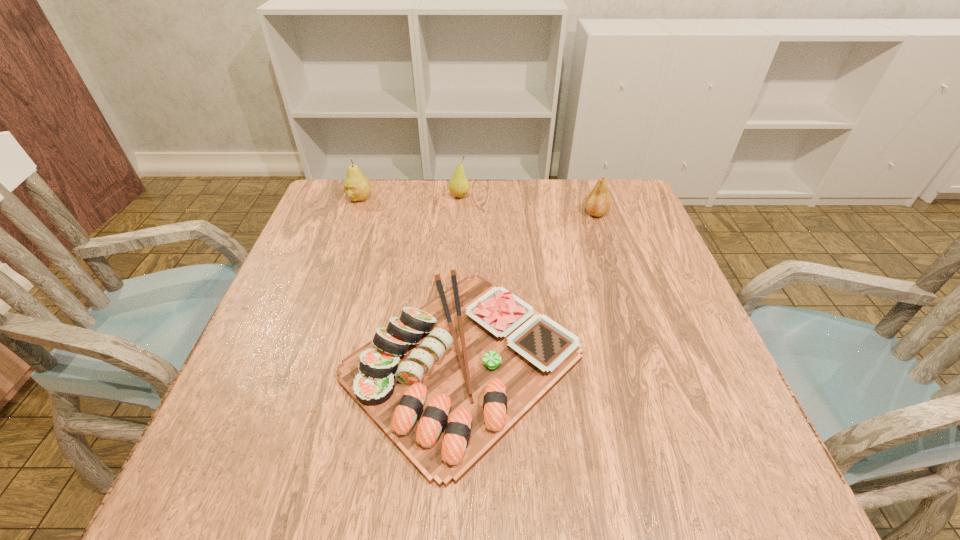
At what (x,y) coordinates should I click in order to perform the action: click on vacant space in between the rightmost object and the shortest object. Please return your answer as a coordinate pair (x, y). This screenshot has height=540, width=960. Looking at the image, I should click on (529, 287).

Select which object appears as the second closest to the second pear from left to right. Please provide its 2D coordinates. Your answer should be formatted as a tuple, i.e. [(x, y)], where the tuple contains the x and y coordinates of a point satisfying the conditions above.

[(445, 382)]

Identify which object is the second nearest to the platter. Please provide its 2D coordinates. Your answer should be formatted as a tuple, i.e. [(x, y)], where the tuple contains the x and y coordinates of a point satisfying the conditions above.

[(356, 186)]

At what (x,y) coordinates should I click in order to perform the action: click on the second closest pear to the leftmost object. Please return your answer as a coordinate pair (x, y). The width and height of the screenshot is (960, 540). Looking at the image, I should click on (598, 202).

Point out which pear is positioned as the second nearest to the leftmost object. Please provide its 2D coordinates. Your answer should be formatted as a tuple, i.e. [(x, y)], where the tuple contains the x and y coordinates of a point satisfying the conditions above.

[(598, 202)]

You are a GUI agent. You are given a task and a screenshot of the screen. Output one action in this format:
    pyautogui.click(x=<x>, y=<y>)
    Task: Click on the vacant space that satisfies the following two spatial constraints: 1. on the back side of the platter; 2. on the right side of the nearest pear
    This screenshot has width=960, height=540.
    Given the screenshot: What is the action you would take?
    pyautogui.click(x=468, y=213)

Where is `vacant space that satisfies the following two spatial constraints: 1. on the front side of the leftmost pear; 2. on the right side of the platter`? The height and width of the screenshot is (540, 960). vacant space that satisfies the following two spatial constraints: 1. on the front side of the leftmost pear; 2. on the right side of the platter is located at coordinates point(300,361).